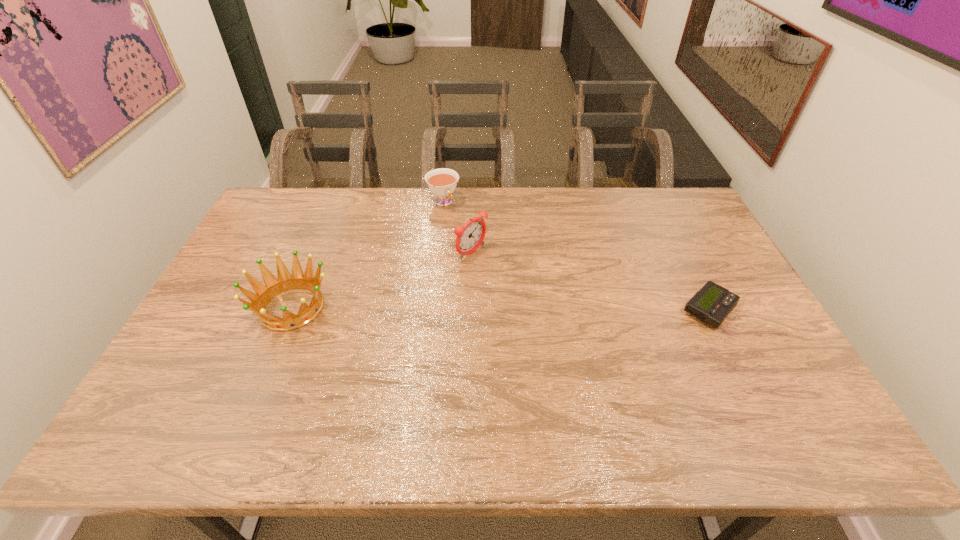
Find the location of a particular element. Image resolution: width=960 pixels, height=540 pixels. object that stands as the second closest to the teacup is located at coordinates (263, 295).

Find the location of a particular element. This screenshot has width=960, height=540. vacant region that satisfies the following two spatial constraints: 1. on the back side of the crown; 2. on the right side of the teacup is located at coordinates (335, 202).

The width and height of the screenshot is (960, 540). In order to click on vacant position in the image that satisfies the following two spatial constraints: 1. on the front side of the alarm clock; 2. on the left side of the beeper in this screenshot , I will do click(470, 310).